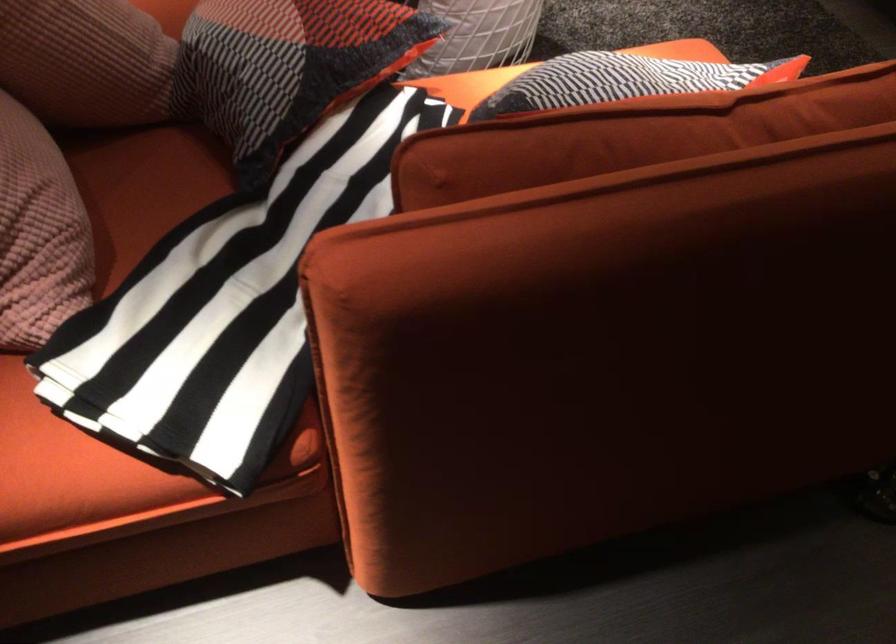
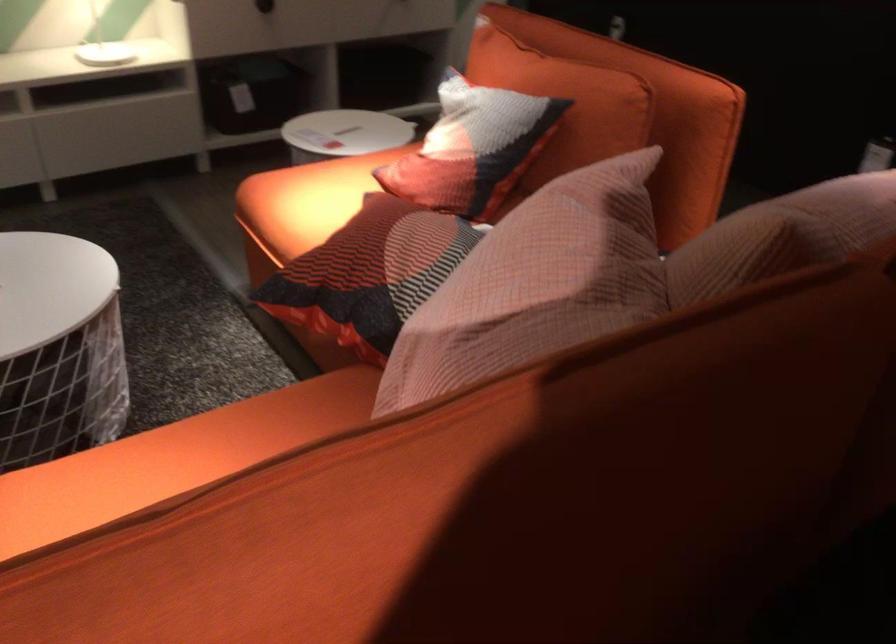
In the second image, find the point that corresponds to point (505, 90) in the first image.

(564, 102)